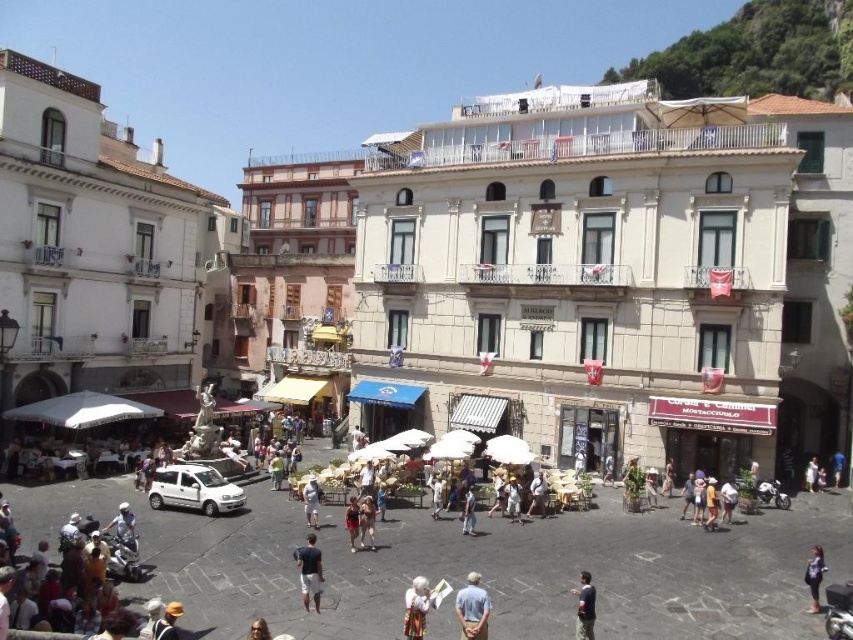
In the scene shown: You are a photographer trying to capture both the light blue shirt at center and the dark blue fabric shirt at center in a single frame. Considering their sizes, which shirt will occupy more space in your photo?

The light blue shirt at center will occupy more space in the photo because its width is larger than that of the dark blue fabric shirt at center.

You are a fashion designer observing the urban square scene. You notice the matte black dress at lower right and the light brown leather jacket at center. Which clothing item appears taller in the image?

The matte black dress at lower right is much taller than the light brown leather jacket at center.